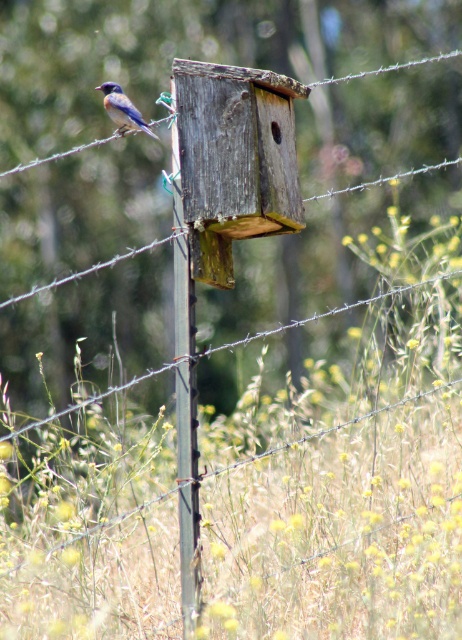
Consider the image. You are a small bird trying to reach the weathered wood bird feeder at center. From your current position on the blue glossy bird at upper left, which direction should you fly to reach the feeder?

The weathered wood bird feeder at center is much taller than the blue glossy bird at upper left, so you should fly downward to reach the feeder.

You are a birdwatcher observing the scene. You notice the weathered wood bird feeder at center and the blue glossy bird at upper left. Which object is positioned higher in the image?

The blue glossy bird at upper left is positioned higher than the weathered wood bird feeder at center.

You are a photographer trying to capture a clear image of the weathered wood bird feeder at center and the blue glossy bird at upper left. Since you want both subjects in focus, which one should you adjust your camera focus on first?

The weathered wood bird feeder at center is closer to the viewer than the blue glossy bird at upper left. To ensure both are in focus, you should focus on the farther object first, which is the blue glossy bird at upper left, as depth of field typically extends further behind the point of focus than in front.